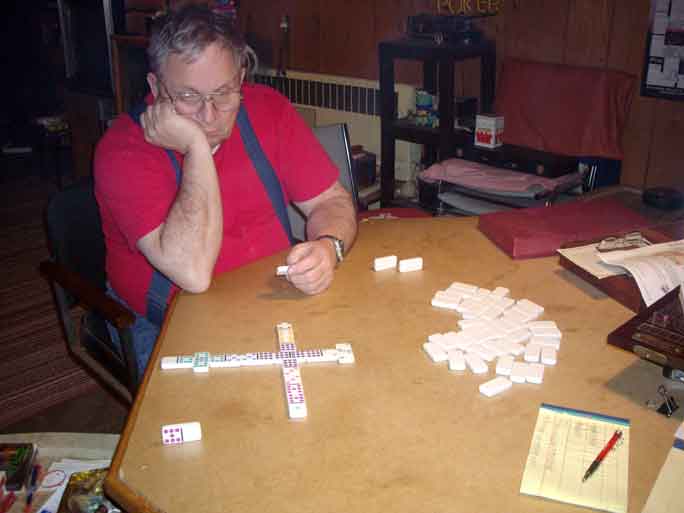
The height and width of the screenshot is (513, 684). Identify the location of table top. (369, 411).